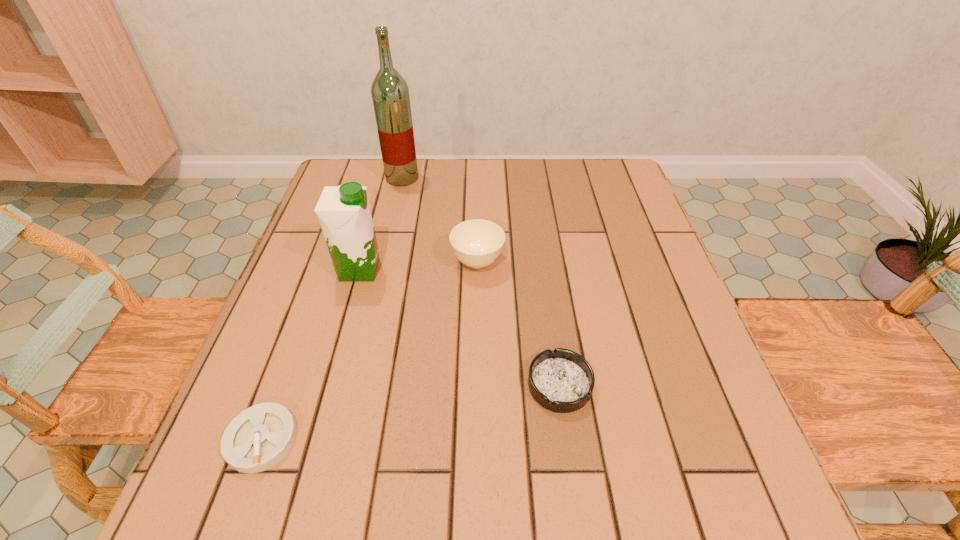
Where is `free area in between the right ashtray and the sugar bowl`? The height and width of the screenshot is (540, 960). free area in between the right ashtray and the sugar bowl is located at coordinates (518, 323).

At what (x,y) coordinates should I click in order to perform the action: click on vacant area that lies between the soya milk and the fourth object from left to right. Please return your answer as a coordinate pair (x, y). Looking at the image, I should click on (419, 266).

I want to click on free spot between the rightmost object and the left ashtray, so click(x=411, y=412).

Find the location of `free space between the left ashtray and the rightmost object`. free space between the left ashtray and the rightmost object is located at coordinates (411, 412).

Find the location of `vacant area between the left ashtray and the sugar bowl`. vacant area between the left ashtray and the sugar bowl is located at coordinates (370, 350).

This screenshot has height=540, width=960. I want to click on free point between the third tallest object and the left ashtray, so click(370, 350).

At what (x,y) coordinates should I click in order to perform the action: click on object that is the closest to the soya milk. Please return your answer as a coordinate pair (x, y). Image resolution: width=960 pixels, height=540 pixels. Looking at the image, I should click on (477, 243).

Locate which object ranks third in proximity to the rightmost object. Please provide its 2D coordinates. Your answer should be formatted as a tuple, i.e. [(x, y)], where the tuple contains the x and y coordinates of a point satisfying the conditions above.

[(258, 438)]

Find the location of a particular element. blank area in the image that satisfies the following two spatial constraints: 1. on the front-facing side of the fourth shortest object; 2. on the back side of the right ashtray is located at coordinates (327, 384).

This screenshot has width=960, height=540. Identify the location of vacant space that satisfies the following two spatial constraints: 1. on the back side of the sugar bowl; 2. on the right side of the left ashtray. (326, 262).